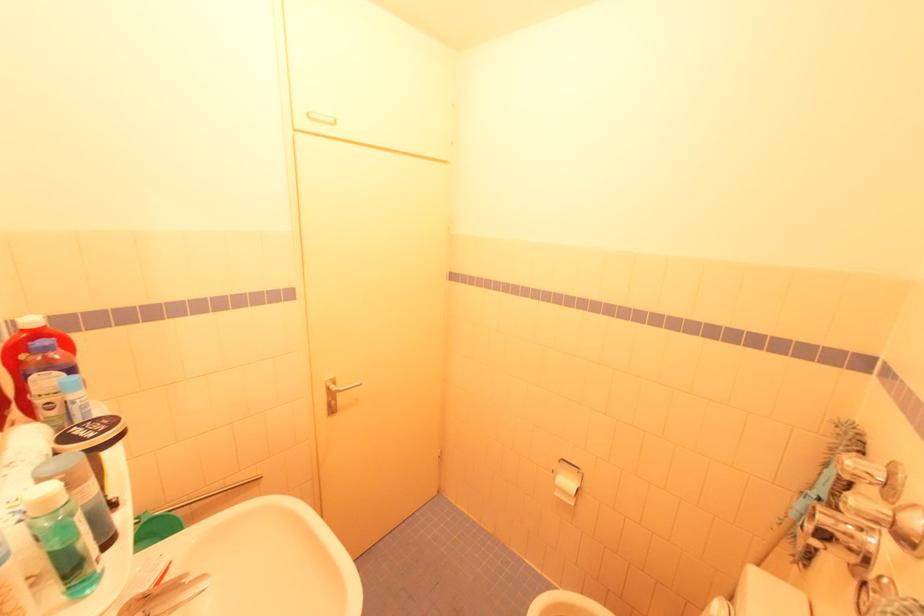
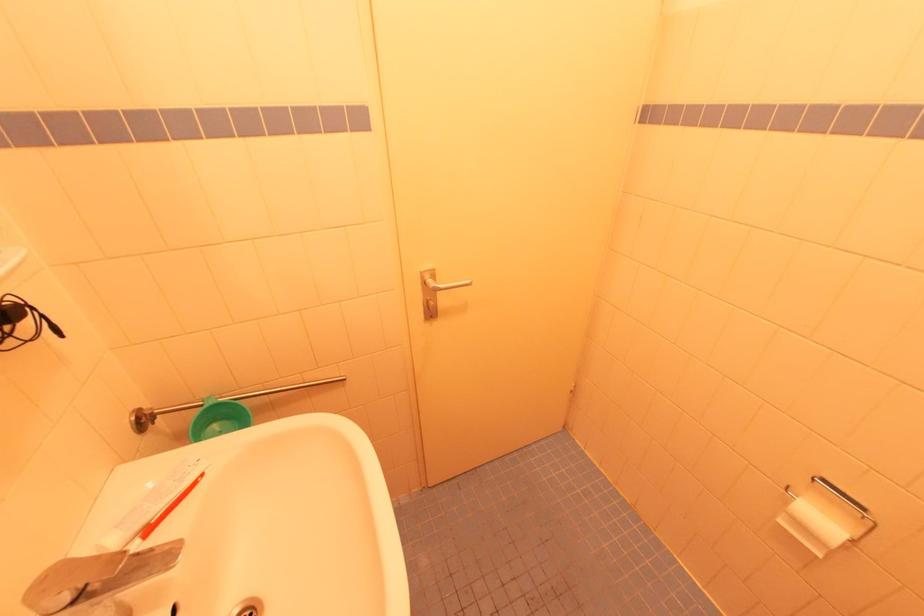
In the second image, find the point that corresponds to point (329, 381) in the first image.

(423, 272)